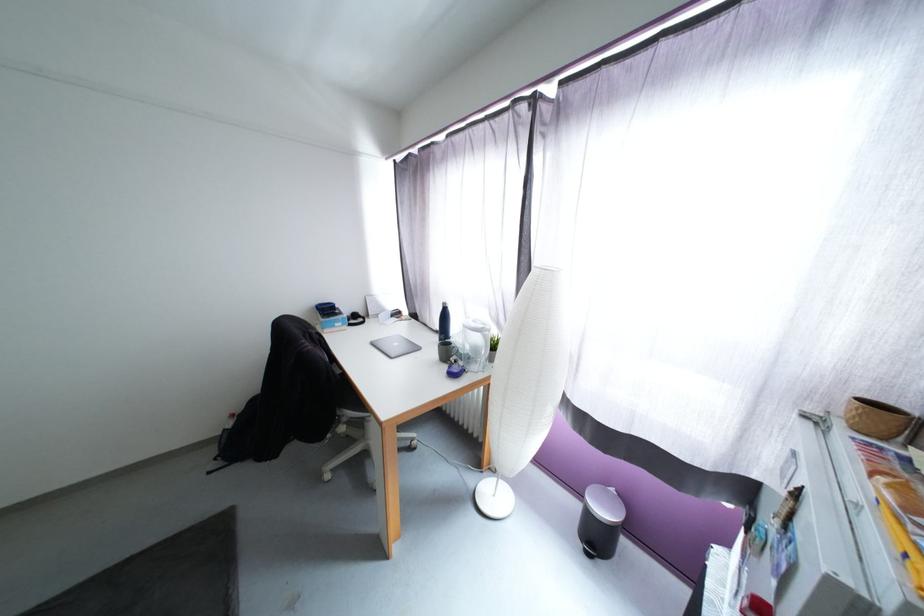
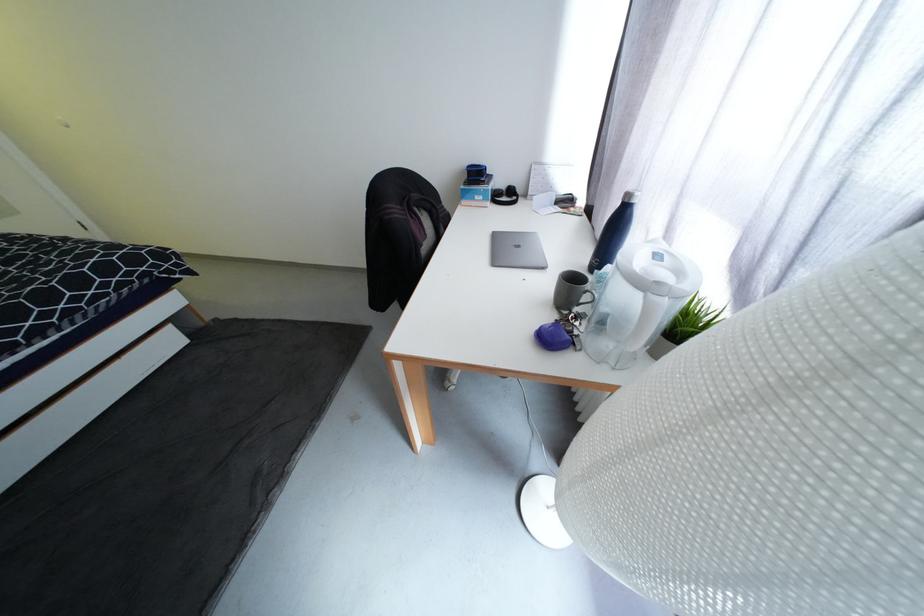
Find the pixel in the second image that matches point 490,326 in the first image.

(686, 274)